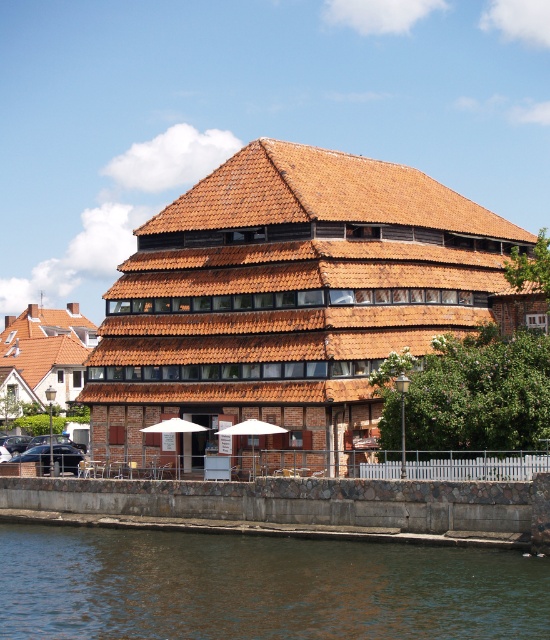
You are a visitor standing in front of the building and want to take a photo that includes both the brown water at lower left and the white fabric umbrella at center. Which object should you position closer to the edge of the photo frame to ensure both are fully visible?

Since the brown water at lower left is wider than the white fabric umbrella at center, you should position the white fabric umbrella at center closer to the edge of the photo frame to ensure both objects are fully visible within the frame.